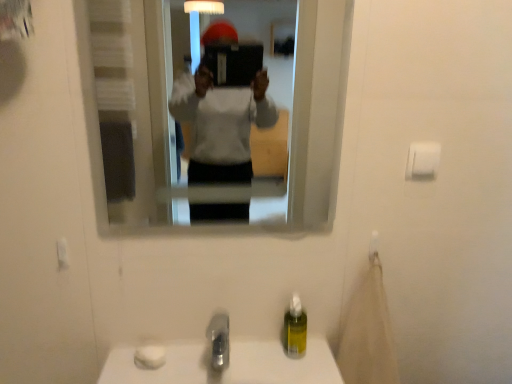
Question: Are white matte toilet paper at upper right and satin nickel faucet at lower center making contact?

Choices:
 (A) yes
 (B) no

Answer: (B)

Question: Is white matte toilet paper at upper right facing away from satin nickel faucet at lower center?

Choices:
 (A) yes
 (B) no

Answer: (B)

Question: Would you say white matte toilet paper at upper right contains satin nickel faucet at lower center?

Choices:
 (A) yes
 (B) no

Answer: (B)

Question: Is the position of white matte toilet paper at upper right more distant than that of satin nickel faucet at lower center?

Choices:
 (A) yes
 (B) no

Answer: (A)

Question: Is white matte toilet paper at upper right positioned beyond the bounds of satin nickel faucet at lower center?

Choices:
 (A) no
 (B) yes

Answer: (B)

Question: Relative to white matte toilet paper at upper right, is yellow translucent soap dispenser at lower center in front or behind?

Choices:
 (A) front
 (B) behind

Answer: (B)

Question: In the image, is yellow translucent soap dispenser at lower center on the left side or the right side of white matte toilet paper at upper right?

Choices:
 (A) left
 (B) right

Answer: (A)

Question: Is point (294, 301) closer or farther from the camera than point (422, 168)?

Choices:
 (A) closer
 (B) farther

Answer: (B)

Question: In terms of height, does yellow translucent soap dispenser at lower center look taller or shorter compared to white matte toilet paper at upper right?

Choices:
 (A) short
 (B) tall

Answer: (B)

Question: In terms of height, does satin nickel faucet at lower center look taller or shorter compared to yellow translucent soap dispenser at lower center?

Choices:
 (A) short
 (B) tall

Answer: (A)

Question: Would you say satin nickel faucet at lower center is inside or outside yellow translucent soap dispenser at lower center?

Choices:
 (A) inside
 (B) outside

Answer: (B)

Question: Is point (226, 342) positioned closer to the camera than point (284, 321)?

Choices:
 (A) farther
 (B) closer

Answer: (B)

Question: From the image's perspective, is satin nickel faucet at lower center above or below yellow translucent soap dispenser at lower center?

Choices:
 (A) below
 (B) above

Answer: (A)

Question: Is clear glass mirror at upper center in front of or behind white matte toilet paper at upper right in the image?

Choices:
 (A) front
 (B) behind

Answer: (A)

Question: Considering the relative positions of clear glass mirror at upper center and white matte toilet paper at upper right in the image provided, is clear glass mirror at upper center to the left or to the right of white matte toilet paper at upper right?

Choices:
 (A) left
 (B) right

Answer: (A)